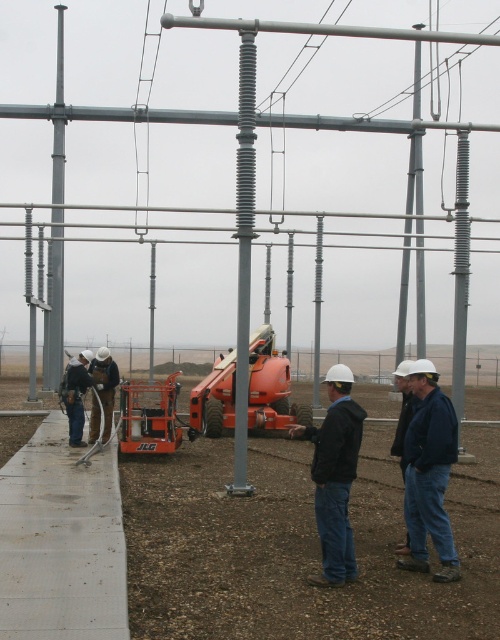
Question: Estimate the real-world distances between objects in this image. Which object is closer to the dark gray hard hat at left?

Choices:
 (A) orange rubber utility vehicle at center
 (B) blue denim jacket at lower right
 (C) gray metallic pole at left
 (D) black matte jacket at center

Answer: (A)

Question: Which object is positioned farthest from the black matte jacket at center?

Choices:
 (A) smooth gray pole at center
 (B) gray metallic pole at center

Answer: (B)

Question: Based on their relative distances, which object is farther from the orange metallic lift at center?

Choices:
 (A) dark gray hard hat at left
 (B) black matte jacket at center
 (C) orange rubber utility vehicle at center

Answer: (B)

Question: Is black matte jacket at center to the left of orange rubber utility vehicle at center from the viewer's perspective?

Choices:
 (A) yes
 (B) no

Answer: (B)

Question: Is black matte jacket at center smaller than dark gray hard hat at left?

Choices:
 (A) no
 (B) yes

Answer: (A)

Question: Does gray rubberized insulator at right come behind dark gray hard hat at left?

Choices:
 (A) yes
 (B) no

Answer: (B)